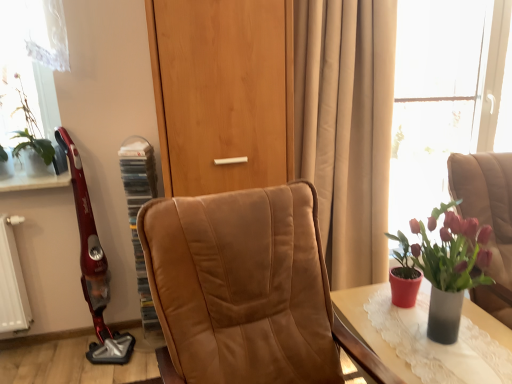
Question: Is wooden door at center to the left of beige fabric curtain at center from the viewer's perspective?

Choices:
 (A) yes
 (B) no

Answer: (A)

Question: Could you tell me if wooden door at center is facing beige fabric curtain at center?

Choices:
 (A) yes
 (B) no

Answer: (B)

Question: From the image's perspective, is wooden door at center on top of beige fabric curtain at center?

Choices:
 (A) no
 (B) yes

Answer: (B)

Question: Is beige fabric curtain at center at the back of wooden door at center?

Choices:
 (A) yes
 (B) no

Answer: (B)

Question: Considering the relative sizes of wooden door at center and beige fabric curtain at center in the image provided, is wooden door at center taller than beige fabric curtain at center?

Choices:
 (A) no
 (B) yes

Answer: (A)

Question: Is point (78, 188) closer or farther from the camera than point (35, 125)?

Choices:
 (A) farther
 (B) closer

Answer: (A)

Question: Looking at their shapes, would you say metallic red vacuum cleaner at left is wider or thinner than green leafy plant at upper left, the 2th houseplant ordered from the bottom?

Choices:
 (A) thin
 (B) wide

Answer: (A)

Question: In the image, is metallic red vacuum cleaner at left on the left side or the right side of green leafy plant at upper left, which is the 2th houseplant in front-to-back order?

Choices:
 (A) right
 (B) left

Answer: (A)

Question: From the image's perspective, relative to green leafy plant at upper left, the first houseplant from the left, is metallic red vacuum cleaner at left above or below?

Choices:
 (A) below
 (B) above

Answer: (A)

Question: Considering the positions of point (415, 3) and point (372, 87), is point (415, 3) closer or farther from the camera than point (372, 87)?

Choices:
 (A) farther
 (B) closer

Answer: (A)

Question: In the image, is transparent glass window at upper right on the left side or the right side of beige fabric curtain at center?

Choices:
 (A) left
 (B) right

Answer: (B)

Question: Based on their sizes in the image, would you say transparent glass window at upper right is bigger or smaller than beige fabric curtain at center?

Choices:
 (A) small
 (B) big

Answer: (A)

Question: Is transparent glass window at upper right inside or outside of beige fabric curtain at center?

Choices:
 (A) outside
 (B) inside

Answer: (A)

Question: Considering the positions of brown leather chair at right, which ranks as the first chair in right-to-left order, and leather chair at center, marked as the 2th chair in a right-to-left arrangement, in the image, is brown leather chair at right, which ranks as the first chair in right-to-left order, wider or thinner than leather chair at center, marked as the 2th chair in a right-to-left arrangement,?

Choices:
 (A) thin
 (B) wide

Answer: (A)

Question: From their relative heights in the image, would you say brown leather chair at right, acting as the second chair starting from the left, is taller or shorter than leather chair at center, marked as the 2th chair in a right-to-left arrangement?

Choices:
 (A) short
 (B) tall

Answer: (A)